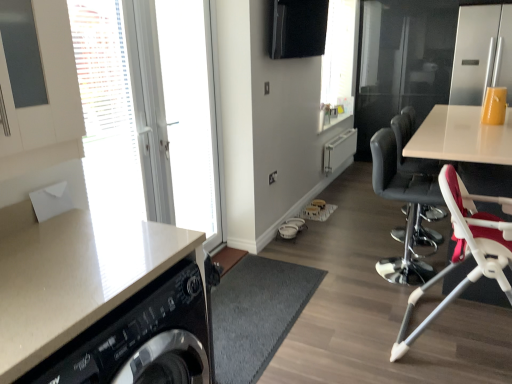
Image resolution: width=512 pixels, height=384 pixels. I want to click on free space that is to the left of black leather chair at right, which appears as the 1th chair when viewed from the back, so click(x=345, y=271).